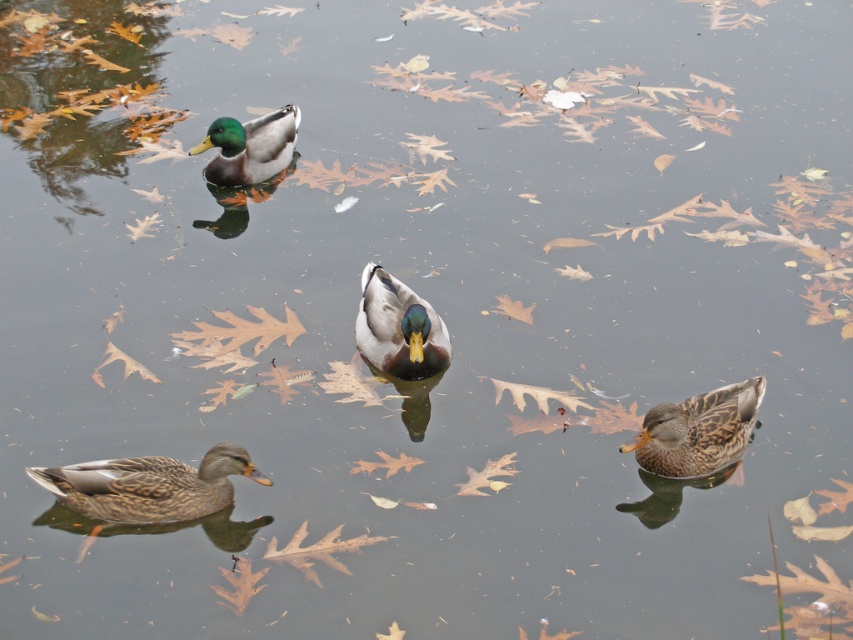
You are a wildlife photographer aiming to capture a closeup shot of the brown matte duck at lower left and the shiny green duck at center. Given that your camera can only focus on one duck at a time, which duck should you focus on to ensure the subject is not too small in the frame?

The brown matte duck at lower left is smaller than the shiny green duck at center, so focusing on the shiny green duck at center will ensure the subject is larger in the frame.

You are standing at the edge of the water and see two points in the scene. The first point is at coordinates point (219, 461) and the second is at point (709, 424). Which point is closer to you?

Point (219, 461) is closer to the viewer than point (709, 424).

You are an observer looking at the scene of four ducks in autumn leaves. You notice the brown matte duck at lower left and the brown speckled duck at lower right. Which duck is positioned lower in the image?

The brown matte duck at lower left is positioned lower than the brown speckled duck at lower right.